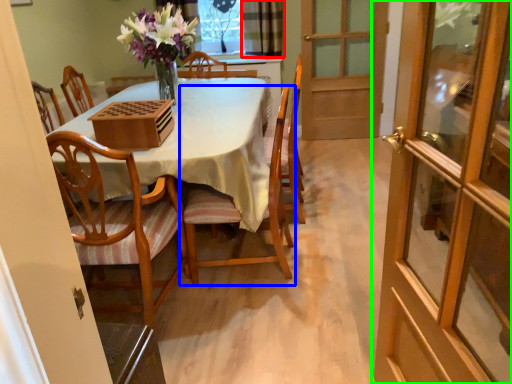
Question: Considering the real-world distances, which object is closest to curtain (highlighted by a red box)? chair (highlighted by a blue box) or door (highlighted by a green box).

Choices:
 (A) chair
 (B) door

Answer: (A)